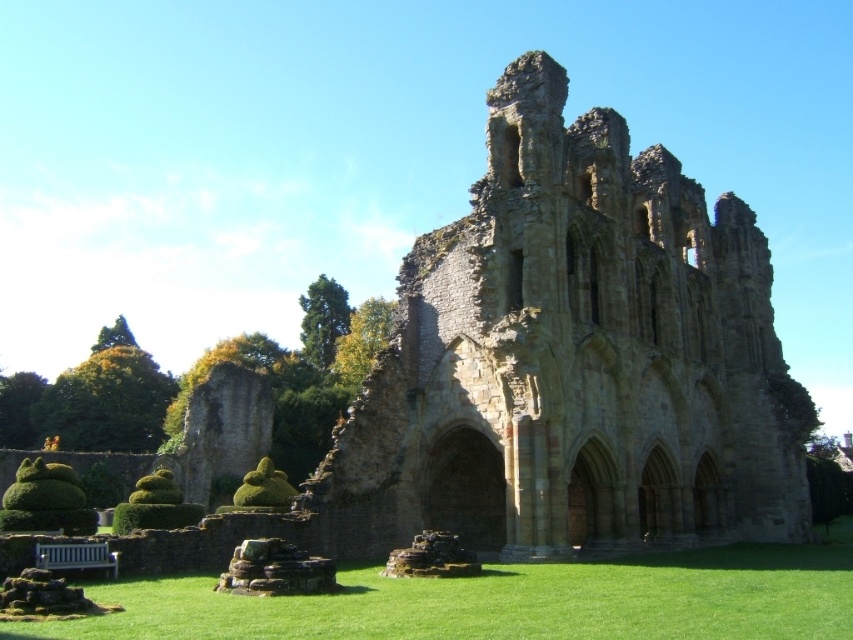
Question: Which point is farther to the camera?

Choices:
 (A) (483, 333)
 (B) (73, 554)
 (C) (689, 604)
 (D) (91, 531)

Answer: (A)

Question: Observing the image, what is the correct spatial positioning of green leafy hedge at left in reference to green leafy hedge at lower left?

Choices:
 (A) left
 (B) right

Answer: (A)

Question: Which of the following is the farthest from the observer?

Choices:
 (A) white wooden bench at lower left
 (B) green grass at lower center
 (C) green leafy hedge at lower left
 (D) green leafy hedge at left

Answer: (D)

Question: Does green leafy hedge at lower left appear over white wooden bench at lower left?

Choices:
 (A) no
 (B) yes

Answer: (A)

Question: Is green leafy hedge at left above green leafy hedge at lower left?

Choices:
 (A) no
 (B) yes

Answer: (B)

Question: Which of the following is the closest to the observer?

Choices:
 (A) tap(599, 614)
 (B) tap(520, 376)
 (C) tap(76, 506)
 (D) tap(109, 566)

Answer: (A)